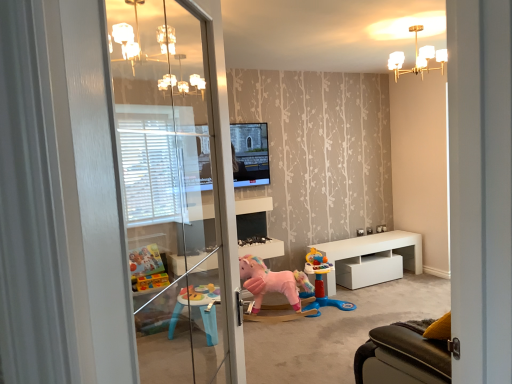
Question: Can you confirm if transparent glass screen door at left is positioned to the right of white glossy table at lower right?

Choices:
 (A) yes
 (B) no

Answer: (B)

Question: Is transparent glass screen door at left not near white glossy table at lower right?

Choices:
 (A) no
 (B) yes

Answer: (B)

Question: From the image's perspective, would you say transparent glass screen door at left is positioned over white glossy table at lower right?

Choices:
 (A) yes
 (B) no

Answer: (A)

Question: Is transparent glass screen door at left facing away from white glossy table at lower right?

Choices:
 (A) yes
 (B) no

Answer: (B)

Question: Does transparent glass screen door at left lie behind white glossy table at lower right?

Choices:
 (A) yes
 (B) no

Answer: (B)

Question: From a real-world perspective, is transparent glass screen door at left under white glossy table at lower right?

Choices:
 (A) no
 (B) yes

Answer: (A)

Question: Does white glossy table at lower right appear on the right side of pink plush unicorn at center, which is the first toy from right to left?

Choices:
 (A) no
 (B) yes

Answer: (B)

Question: Does white glossy table at lower right come behind pink plush unicorn at center, which is the first toy from right to left?

Choices:
 (A) yes
 (B) no

Answer: (A)

Question: Considering the relative positions of white glossy table at lower right and pink plush unicorn at center, which is the first toy from right to left, in the image provided, is white glossy table at lower right to the left of pink plush unicorn at center, which is the first toy from right to left, from the viewer's perspective?

Choices:
 (A) yes
 (B) no

Answer: (B)

Question: Is pink plush unicorn at center, which is the first toy from right to left, surrounded by white glossy table at lower right?

Choices:
 (A) no
 (B) yes

Answer: (A)

Question: Is white glossy table at lower right oriented away from pink plush unicorn at center, the 2th toy viewed from the left?

Choices:
 (A) yes
 (B) no

Answer: (B)

Question: Is white glossy table at lower right thinner than pink plush unicorn at center, which is the first toy from right to left?

Choices:
 (A) no
 (B) yes

Answer: (B)

Question: Is matte black television at center shorter than white glossy table at lower right?

Choices:
 (A) yes
 (B) no

Answer: (B)